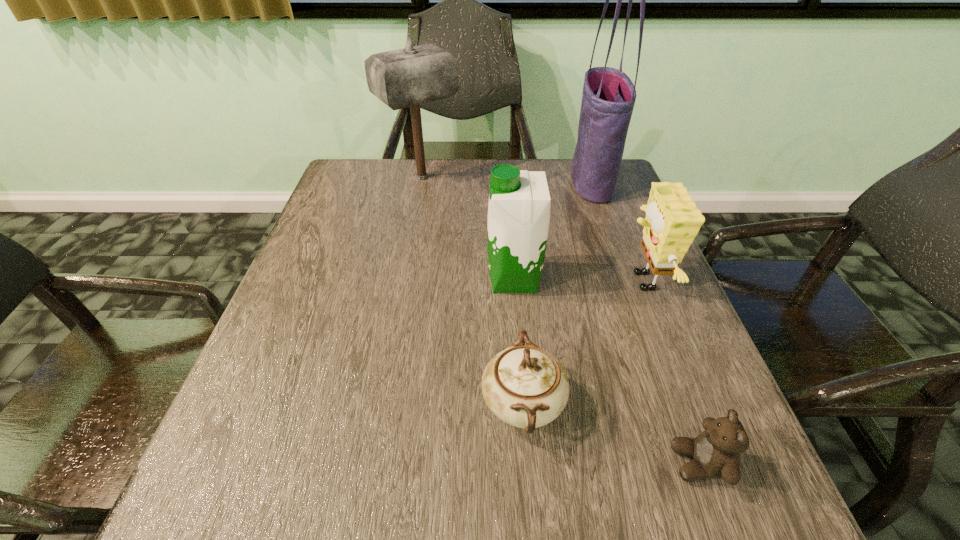
Identify the location of mallet that is at the far edge. (408, 77).

This screenshot has height=540, width=960. In order to click on object present at the near edge in this screenshot , I will do `click(715, 453)`.

Where is `object that is at the left edge`? This screenshot has height=540, width=960. object that is at the left edge is located at coordinates (408, 77).

You are a GUI agent. You are given a task and a screenshot of the screen. Output one action in this format:
    pyautogui.click(x=<x>, y=<y>)
    Task: Click on the tote bag located in the right edge section of the desktop
    The image size is (960, 540).
    Given the screenshot: What is the action you would take?
    pyautogui.click(x=608, y=99)

Find the location of a particular element. The image size is (960, 540). sponge that is at the right edge is located at coordinates (672, 221).

What are the coordinates of `teddy bear that is at the right edge` in the screenshot? It's located at (715, 453).

The height and width of the screenshot is (540, 960). In order to click on object that is positioned at the far left corner in this screenshot , I will do `click(408, 77)`.

Find the location of a particular element. Image resolution: width=960 pixels, height=540 pixels. object that is at the far right corner is located at coordinates (608, 99).

Where is `object that is positioned at the near right corner`? object that is positioned at the near right corner is located at coordinates (715, 453).

The width and height of the screenshot is (960, 540). Identify the location of vacant space at the far edge. (447, 163).